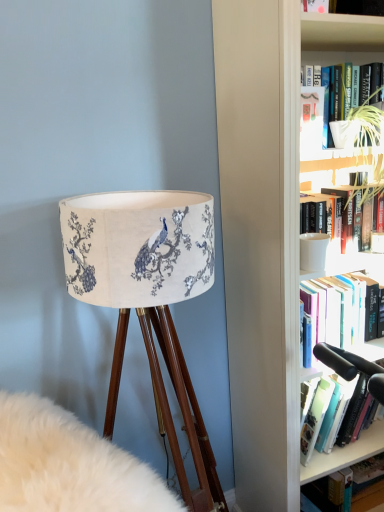
Question: Looking at the image, does matte fabric lampshade at left seem bigger or smaller compared to hardcover book at lower right, the second book in the front-to-back sequence?

Choices:
 (A) big
 (B) small

Answer: (A)

Question: From the image's perspective, is matte fabric lampshade at left above or below hardcover book at lower right, the second book in the front-to-back sequence?

Choices:
 (A) below
 (B) above

Answer: (B)

Question: Estimate the real-world distances between objects in this image. Which object is closer to the matte fabric lampshade at left?

Choices:
 (A) hardcover book at lower right, the 1th book viewed from the back
 (B) wooden tripod lamp at left
 (C) white matte mug at upper right, positioned as the first book in top-to-bottom order
 (D) matte white paperback book at upper right

Answer: (B)

Question: Which object is positioned closest to the matte fabric lampshade at left?

Choices:
 (A) white matte mug at upper right, which is counted as the 1th book, starting from the front
 (B) hardcover book at lower right, which appears as the first book when ordered from the bottom
 (C) wooden tripod lamp at left
 (D) matte white paperback book at upper right

Answer: (C)